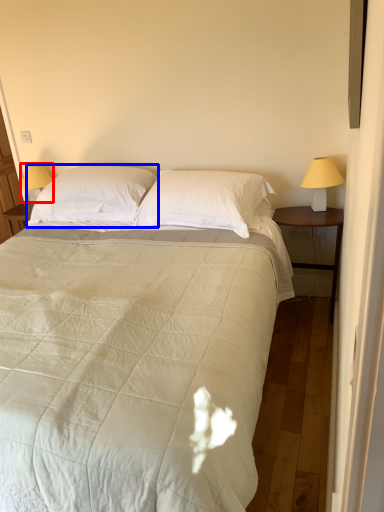
Question: Among these objects, which one is nearest to the camera, table lamp (highlighted by a red box) or pillow (highlighted by a blue box)?

Choices:
 (A) table lamp
 (B) pillow

Answer: (B)